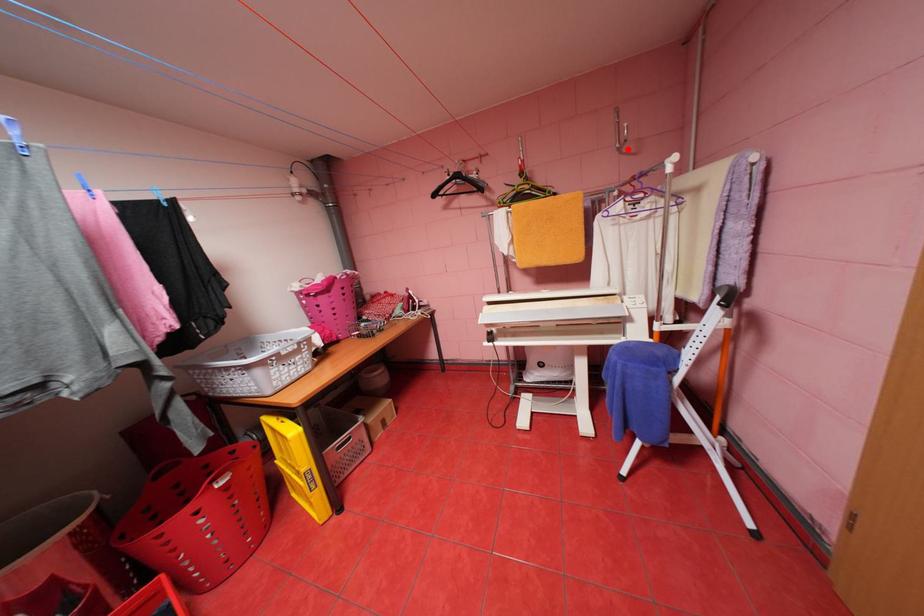
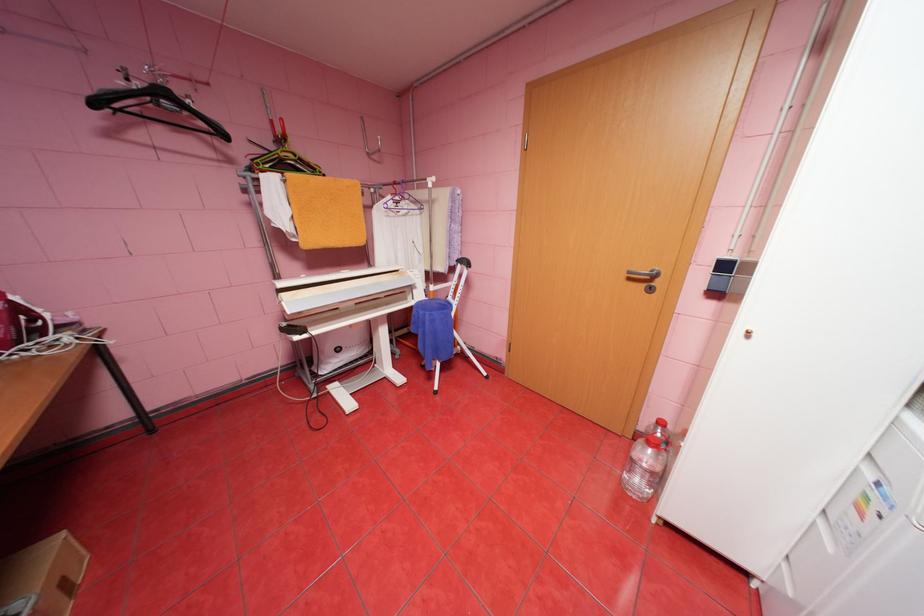
The point at the highlighted location is marked in the first image. Where is the corresponding point in the second image?

(377, 154)